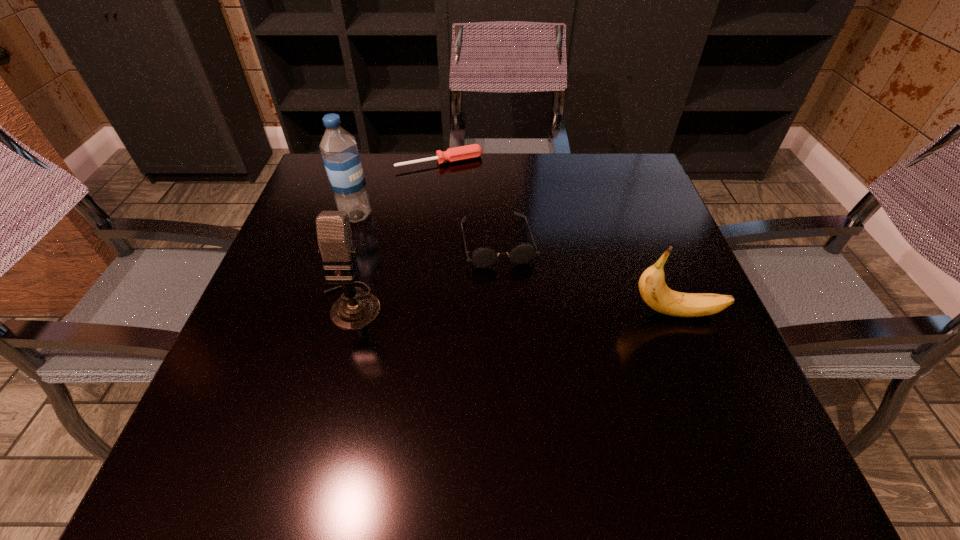
You are a GUI agent. You are given a task and a screenshot of the screen. Output one action in this format:
    pyautogui.click(x=<x>, y=<y>)
    Task: Click on the microphone
    
    Given the screenshot: What is the action you would take?
    pyautogui.click(x=355, y=309)

This screenshot has height=540, width=960. In order to click on banana in this screenshot , I will do `click(652, 286)`.

I want to click on the rightmost object, so click(x=652, y=286).

Identify the location of the farthest object. The image size is (960, 540). (455, 154).

At what (x,y) coordinates should I click in order to perform the action: click on the shortest object. Please return your answer as a coordinate pair (x, y). This screenshot has width=960, height=540. Looking at the image, I should click on (455, 154).

Where is `water bottle`? Image resolution: width=960 pixels, height=540 pixels. water bottle is located at coordinates (339, 150).

Locate an element on the screen. the fourth tallest object is located at coordinates (482, 257).

Where is `free space located at the tip of the farthest object`? The width and height of the screenshot is (960, 540). free space located at the tip of the farthest object is located at coordinates (501, 262).

Where is `vacant space located 0.130m at the tip of the farthest object`? The width and height of the screenshot is (960, 540). vacant space located 0.130m at the tip of the farthest object is located at coordinates (467, 198).

Where is `vacant space located 0.160m at the tip of the farthest object`? vacant space located 0.160m at the tip of the farthest object is located at coordinates (470, 205).